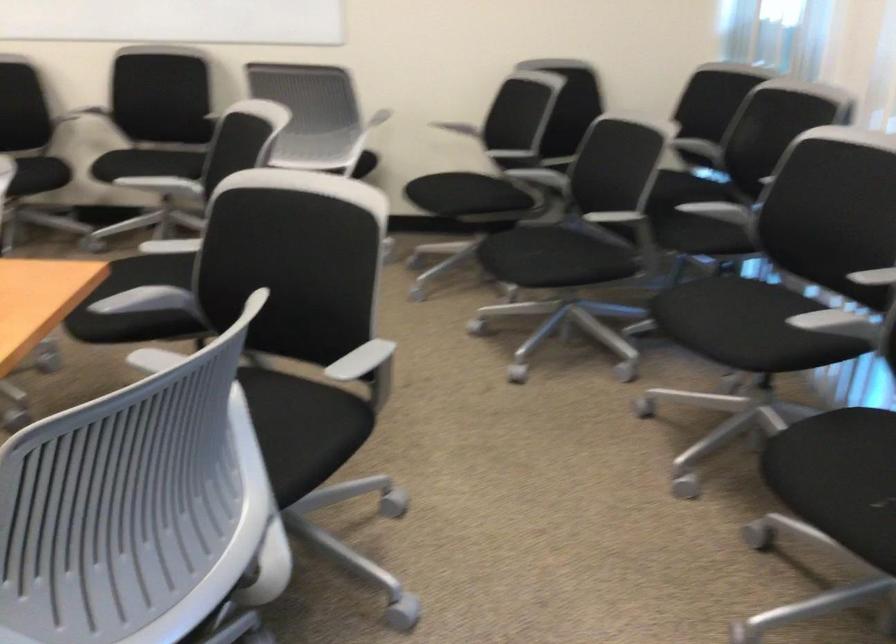
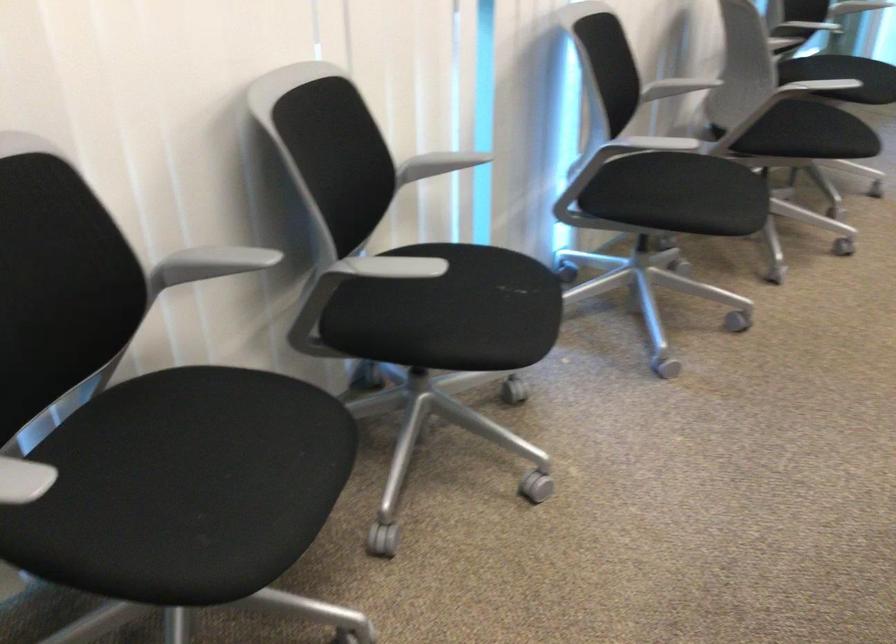
Where in the second image is the point corresponding to [735,319] from the first image?

(226, 456)